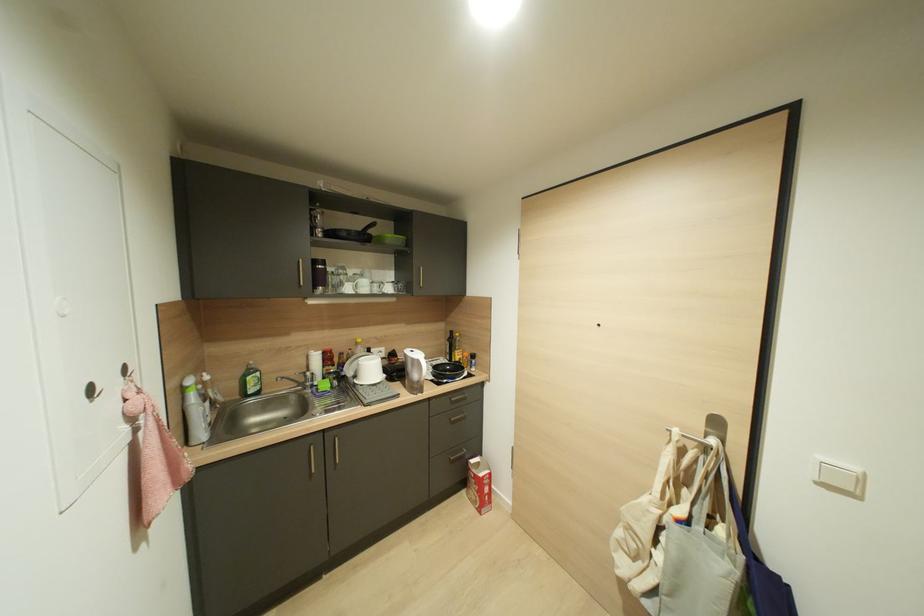
You are a GUI agent. You are given a task and a screenshot of the screen. Output one action in this format:
    pyautogui.click(x=<x>, y=<y>)
    Task: Click on the black pan handle
    The width and height of the screenshot is (924, 616).
    Given the screenshot: What is the action you would take?
    pyautogui.click(x=363, y=233)